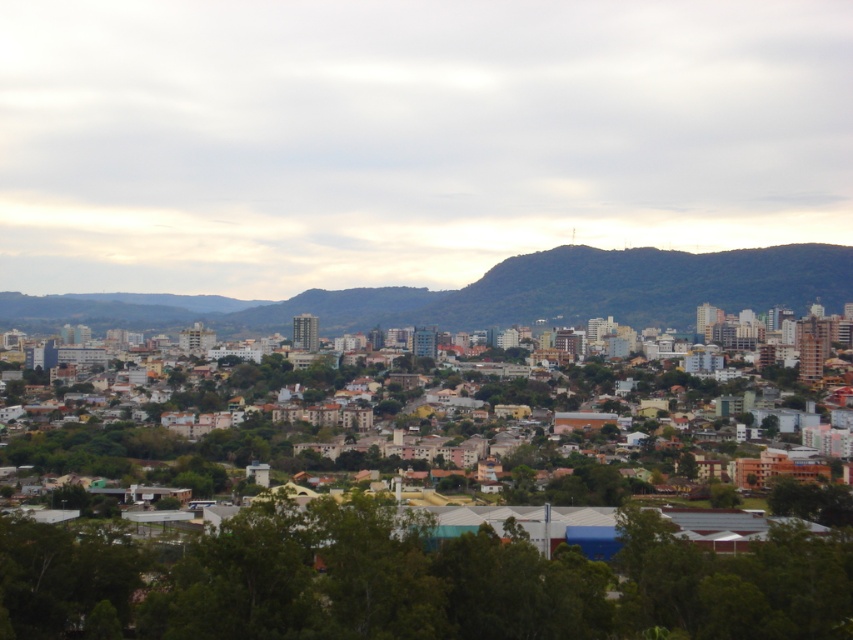
Question: Considering the relative positions of green leafy tree at lower center and green forested mountain at center in the image provided, where is green leafy tree at lower center located with respect to green forested mountain at center?

Choices:
 (A) above
 (B) below

Answer: (B)

Question: Which point is closer to the camera taking this photo?

Choices:
 (A) (459, 596)
 (B) (677, 252)

Answer: (A)

Question: Is green leafy tree at lower center behind green forested mountain at center?

Choices:
 (A) yes
 (B) no

Answer: (A)

Question: Is green leafy tree at lower center positioned at the back of green forested mountain at center?

Choices:
 (A) no
 (B) yes

Answer: (B)